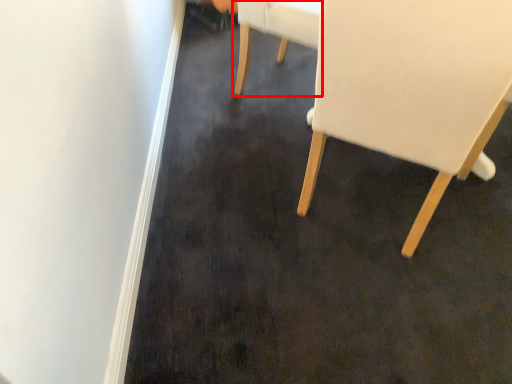
Question: In this image, where is chair (annotated by the red box) located relative to chair?

Choices:
 (A) right
 (B) left

Answer: (B)